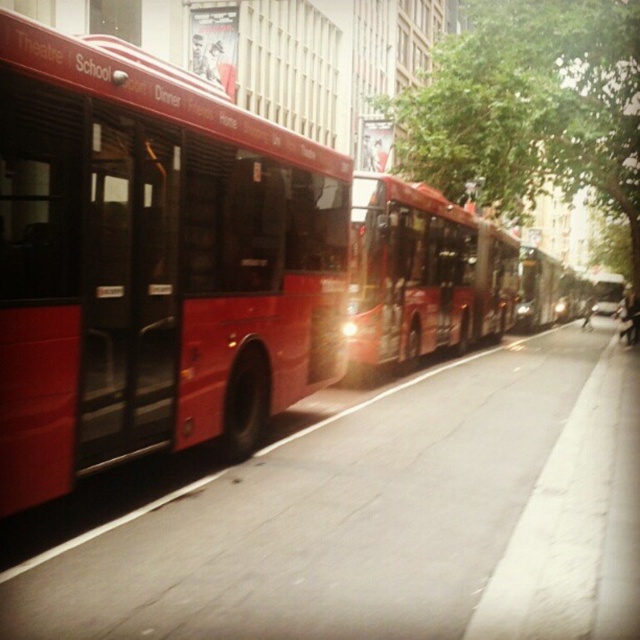
You are a city planner analyzing this street scene. You notice two buses labeled as shiny red bus at center and metallic red bus at center. Which one has a greater height?

The shiny red bus at center is taller than the metallic red bus at center according to the description.

From the picture: You are a pedestrian standing on the sidewalk and see both the shiny red bus at center and the metallic red bus at center. Which one appears closer to you?

The shiny red bus at center appears closer because it is positioned over the metallic red bus at center, indicating it is in front.

Based on the photo, you are a city planner analyzing traffic flow. You observe the matte red bus at left and the shiny red bus at center in the scene. Which bus takes up more space on the road?

The shiny red bus at center occupies more space than the matte red bus at left according to the description.